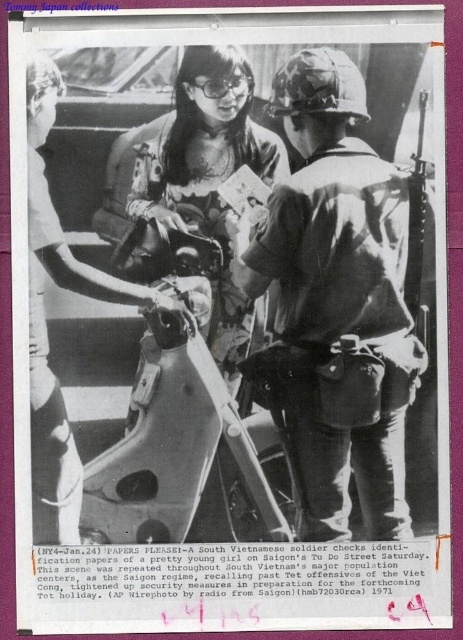
Which is below, floral-patterned blouse at center or matte black goggles at upper center?

floral-patterned blouse at center

Is point (268, 141) behind point (241, 92)?

Yes.

At what (x,y) coordinates should I click in order to perform the action: click on floral-patterned blouse at center. Please return your answer as a coordinate pair (x, y). Image resolution: width=463 pixels, height=640 pixels. Looking at the image, I should click on (207, 186).

Which is more to the right, camouflage fabric helmet at center or floral-patterned blouse at center?

Positioned to the right is camouflage fabric helmet at center.

Describe the element at coordinates (337, 305) in the screenshot. The height and width of the screenshot is (640, 463). I see `camouflage fabric helmet at center` at that location.

Identify the location of camouflage fabric helmet at center. This screenshot has height=640, width=463. (337, 305).

Between point (370, 168) and point (206, 92), which one is positioned in front?

Positioned in front is point (206, 92).

Find the location of `camouflage fabric helmet at center`. camouflage fabric helmet at center is located at coordinates (337, 305).